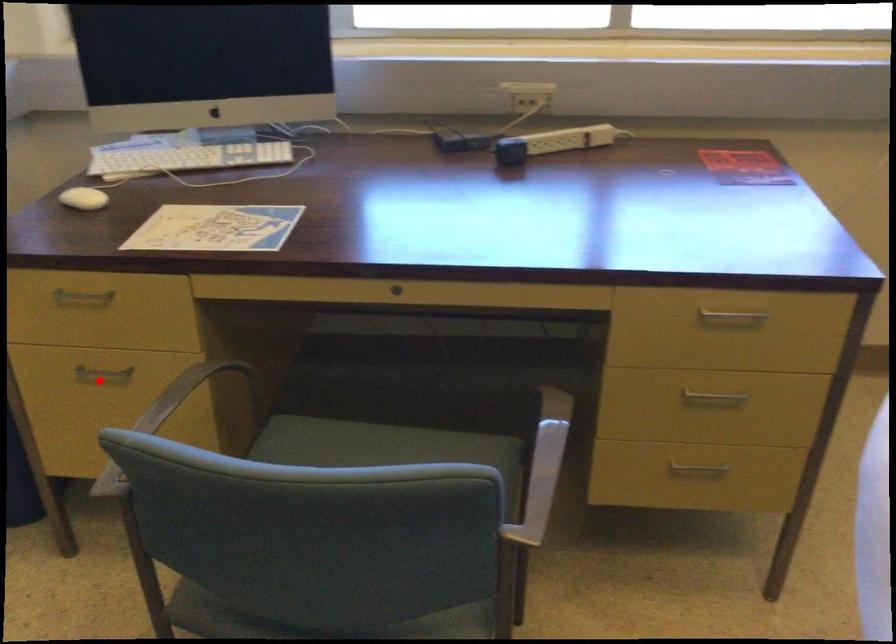
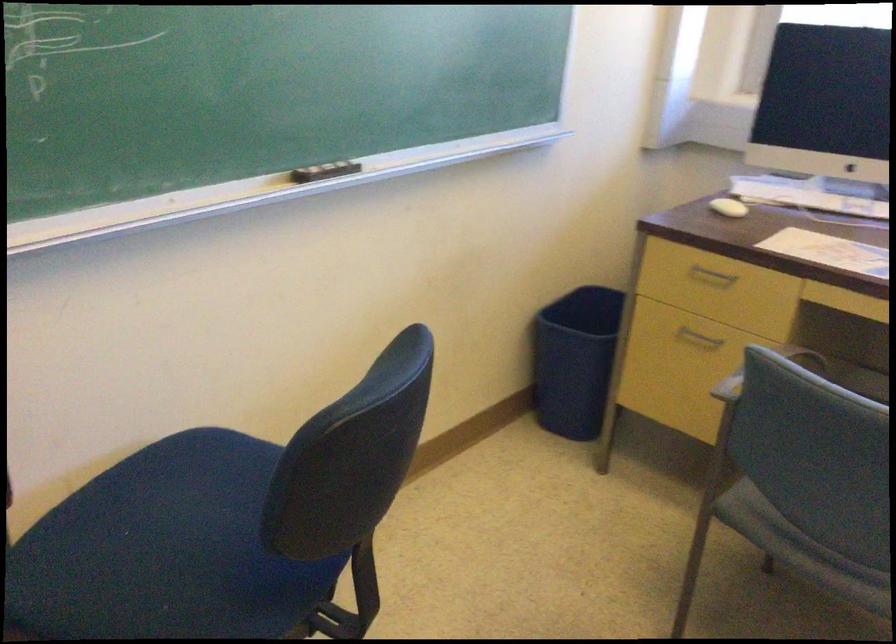
Locate, in the second image, the point that corresponds to the highlighted location in the first image.

(698, 337)